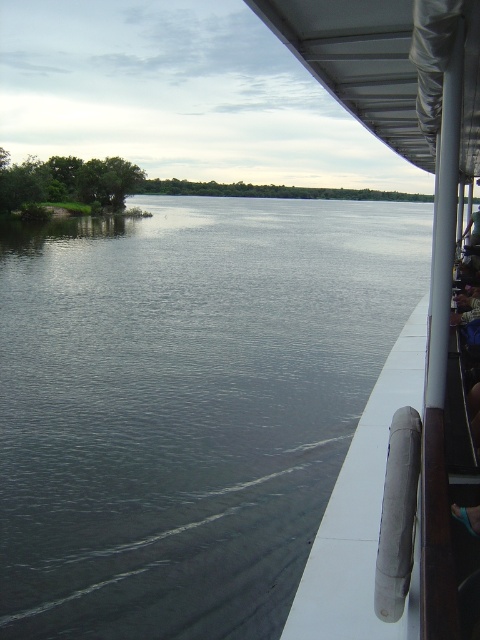
Question: Is gray smooth water at center wider than white rubber handrail at right?

Choices:
 (A) no
 (B) yes

Answer: (B)

Question: Can you confirm if gray smooth water at center is smaller than white rubber handrail at right?

Choices:
 (A) no
 (B) yes

Answer: (A)

Question: Which point appears closest to the camera in this image?

Choices:
 (A) (441, 296)
 (B) (93, 262)

Answer: (A)

Question: Which point is farther from the camera taking this photo?

Choices:
 (A) pyautogui.click(x=75, y=529)
 (B) pyautogui.click(x=456, y=259)

Answer: (B)

Question: Does gray smooth water at center lie behind white rubber handrail at right?

Choices:
 (A) no
 (B) yes

Answer: (B)

Question: Which point is farther from the camera taking this photo?

Choices:
 (A) (100, 412)
 (B) (411, 61)

Answer: (A)